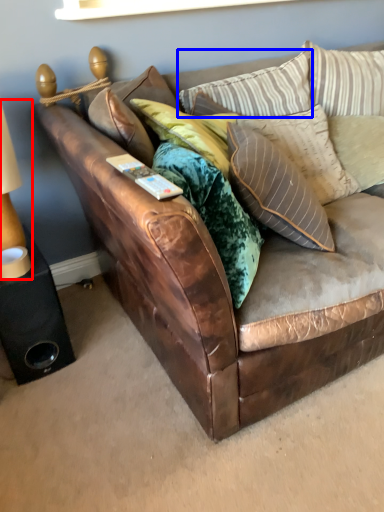
Question: Among these objects, which one is nearest to the camera, table lamp (highlighted by a red box) or pillow (highlighted by a blue box)?

Choices:
 (A) table lamp
 (B) pillow

Answer: (A)